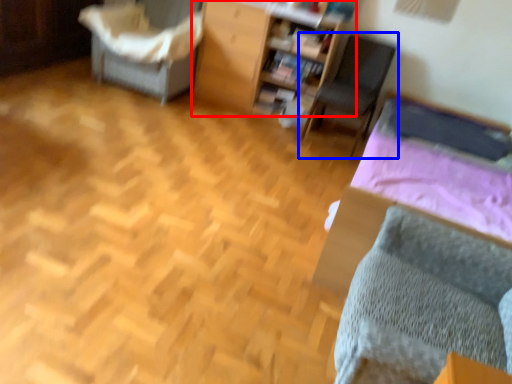
Question: Which object is further to the camera taking this photo, furniture (highlighted by a red box) or chair (highlighted by a blue box)?

Choices:
 (A) furniture
 (B) chair

Answer: (A)